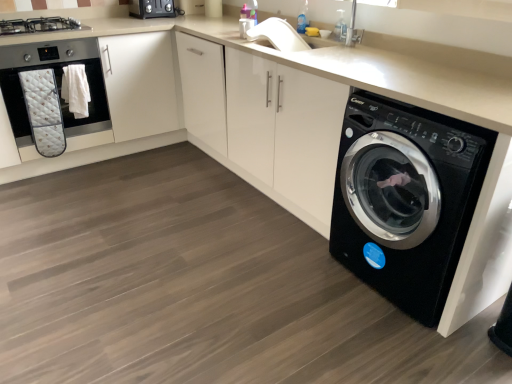
Question: Is satin black stove at upper left to the right of black glossy washing machine at lower right from the viewer's perspective?

Choices:
 (A) no
 (B) yes

Answer: (A)

Question: Can you confirm if satin black stove at upper left is positioned to the left of black glossy washing machine at lower right?

Choices:
 (A) yes
 (B) no

Answer: (A)

Question: Is satin black stove at upper left far away from black glossy washing machine at lower right?

Choices:
 (A) yes
 (B) no

Answer: (A)

Question: Considering the relative sizes of satin black stove at upper left and black glossy washing machine at lower right in the image provided, is satin black stove at upper left thinner than black glossy washing machine at lower right?

Choices:
 (A) no
 (B) yes

Answer: (B)

Question: Considering the relative sizes of satin black stove at upper left and black glossy washing machine at lower right in the image provided, is satin black stove at upper left wider than black glossy washing machine at lower right?

Choices:
 (A) no
 (B) yes

Answer: (A)

Question: Is satin black stove at upper left placed right next to black glossy washing machine at lower right?

Choices:
 (A) yes
 (B) no

Answer: (B)

Question: From the image's perspective, is matte black oven at left on top of black glossy washing machine at lower right?

Choices:
 (A) yes
 (B) no

Answer: (A)

Question: Could you tell me if matte black oven at left is turned towards black glossy washing machine at lower right?

Choices:
 (A) yes
 (B) no

Answer: (A)

Question: Is there a large distance between matte black oven at left and black glossy washing machine at lower right?

Choices:
 (A) no
 (B) yes

Answer: (B)

Question: Is matte black oven at left bigger than black glossy washing machine at lower right?

Choices:
 (A) no
 (B) yes

Answer: (A)

Question: From the image's perspective, is matte black oven at left below black glossy washing machine at lower right?

Choices:
 (A) yes
 (B) no

Answer: (B)

Question: Considering the relative sizes of matte black oven at left and black glossy washing machine at lower right in the image provided, is matte black oven at left taller than black glossy washing machine at lower right?

Choices:
 (A) yes
 (B) no

Answer: (B)

Question: From a real-world perspective, is black glossy washing machine at lower right on top of satin black toaster at upper center?

Choices:
 (A) no
 (B) yes

Answer: (A)